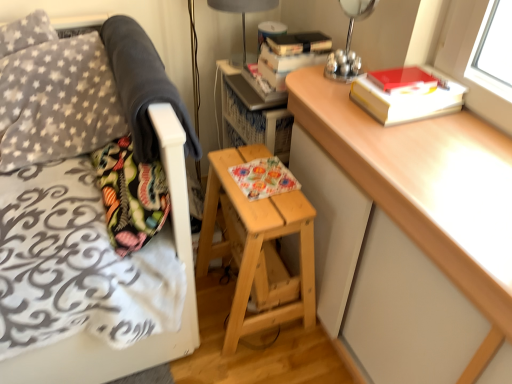
Question: Considering their positions, is light brown wooden stool at center located in front of or behind matte red paperback book at upper right, which is counted as the first paperback book, starting from the top?

Choices:
 (A) behind
 (B) front

Answer: (A)

Question: Which is correct: light brown wooden stool at center is inside matte red paperback book at upper right, which is counted as the first paperback book, starting from the top, or outside of it?

Choices:
 (A) outside
 (B) inside

Answer: (A)

Question: Based on their relative distances, which object is nearer to the matte red paperback book at upper right, which appears as the second paperback book when ordered from the bottom?

Choices:
 (A) light wood desk at upper right
 (B) hardcover book at upper right, the second paperback book when ordered from top to bottom
 (C) matte gray lampshade at upper center, the 1th bedside lamp positioned from the back
 (D) floral paper book at center, placed as the 2th book when sorted from top to bottom
 (E) fluffy fabric pillow at left

Answer: (B)

Question: Estimate the real-world distances between objects in this image. Which object is closer to the dark gray fleece blanket at upper left?

Choices:
 (A) hardcover book at upper center, the first book when ordered from top to bottom
 (B) gray fleece throw pillow at upper left
 (C) matte gray lampshade at upper center, which appears as the second bedside lamp when viewed from the front
 (D) light wood desk at upper right
 (E) metallic silver lamp at upper right, which is counted as the 1th bedside lamp, starting from the right

Answer: (B)